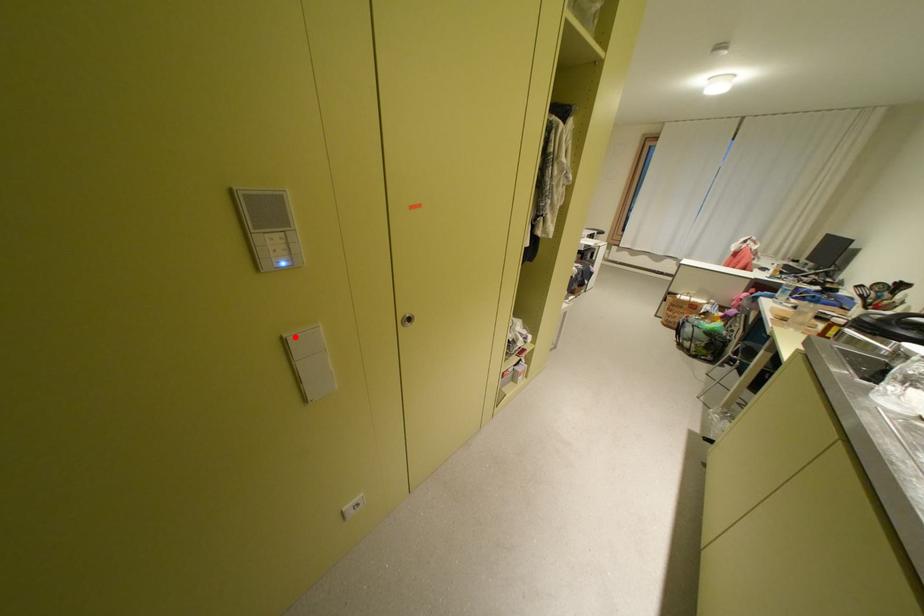
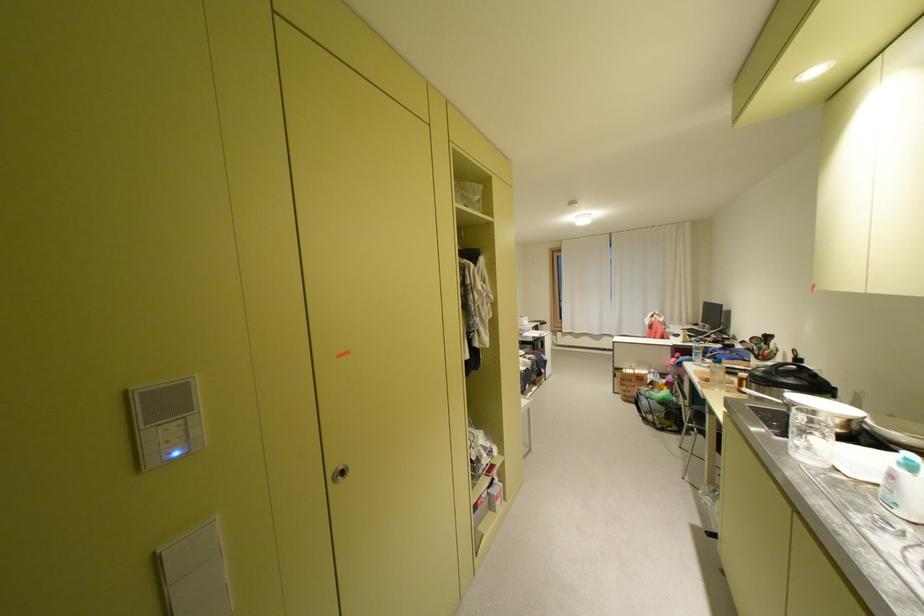
The point at the highlighted location is marked in the first image. Where is the corresponding point in the second image?

(169, 552)